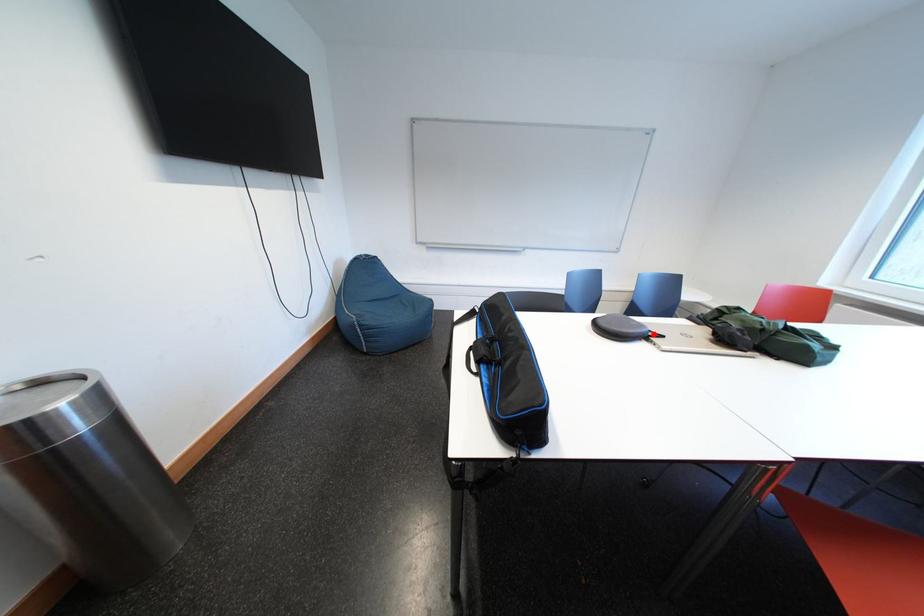
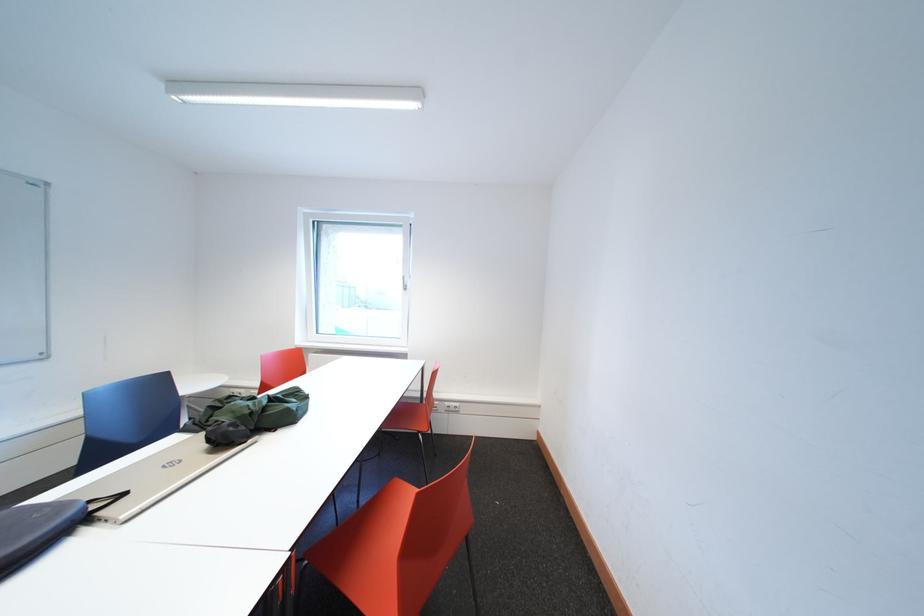
Find the pixel in the second image that matches the highlighted location in the first image.

(79, 517)